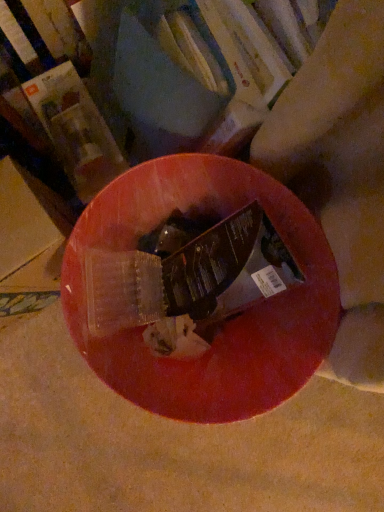
What do you see at coordinates (143, 79) in the screenshot? I see `hardcover book at center, placed as the second book when sorted from left to right` at bounding box center [143, 79].

Where is `hardcover book at center, which is counted as the first book, starting from the right`? This screenshot has width=384, height=512. hardcover book at center, which is counted as the first book, starting from the right is located at coordinates (143, 79).

The width and height of the screenshot is (384, 512). What do you see at coordinates (62, 91) in the screenshot? I see `matte plastic book at upper left, the first book positioned from the left` at bounding box center [62, 91].

Find the location of `matte plastic book at upper left, the first book positioned from the left`. matte plastic book at upper left, the first book positioned from the left is located at coordinates (62, 91).

This screenshot has width=384, height=512. I want to click on hardcover book at center, which is counted as the first book, starting from the right, so click(x=143, y=79).

Is hardcover book at center, placed as the second book when sorted from left to right, at the right side of matte plastic book at upper left, the first book positioned from the left?

Yes.

Based on the photo, which is in front, hardcover book at center, placed as the second book when sorted from left to right, or matte plastic book at upper left, which ranks as the 2th book in right-to-left order?

hardcover book at center, placed as the second book when sorted from left to right, is more forward.

Considering the positions of points (220, 35) and (36, 70), is point (220, 35) farther from camera compared to point (36, 70)?

No, (220, 35) is in front of (36, 70).

From the image's perspective, between hardcover book at center, placed as the second book when sorted from left to right, and matte plastic book at upper left, which ranks as the 2th book in right-to-left order, which one is located above?

From the image's view, hardcover book at center, placed as the second book when sorted from left to right, is above.

From a real-world perspective, between hardcover book at center, which is counted as the first book, starting from the right, and matte plastic book at upper left, which ranks as the 2th book in right-to-left order, who is vertically higher?

From a 3D spatial view, hardcover book at center, which is counted as the first book, starting from the right, is above.

Considering the relative sizes of hardcover book at center, placed as the second book when sorted from left to right, and matte plastic book at upper left, the first book positioned from the left, in the image provided, is hardcover book at center, placed as the second book when sorted from left to right, wider than matte plastic book at upper left, the first book positioned from the left,?

Incorrect, the width of hardcover book at center, placed as the second book when sorted from left to right, does not surpass that of matte plastic book at upper left, the first book positioned from the left.

In terms of height, does hardcover book at center, which is counted as the first book, starting from the right, look taller or shorter compared to matte plastic book at upper left, which ranks as the 2th book in right-to-left order?

Clearly, hardcover book at center, which is counted as the first book, starting from the right, is taller compared to matte plastic book at upper left, which ranks as the 2th book in right-to-left order.

Can you confirm if hardcover book at center, placed as the second book when sorted from left to right, is bigger than matte plastic book at upper left, the first book positioned from the left?

Yes.

Is matte plastic book at upper left, which ranks as the 2th book in right-to-left order, located within hardcover book at center, placed as the second book when sorted from left to right?

No.

Is hardcover book at center, which is counted as the first book, starting from the right, directly adjacent to matte plastic book at upper left, the first book positioned from the left?

Yes, hardcover book at center, which is counted as the first book, starting from the right, is in contact with matte plastic book at upper left, the first book positioned from the left.

Consider the image. Is hardcover book at center, placed as the second book when sorted from left to right, positioned with its back to matte plastic book at upper left, which ranks as the 2th book in right-to-left order?

No, matte plastic book at upper left, which ranks as the 2th book in right-to-left order, is not at the back of hardcover book at center, placed as the second book when sorted from left to right.

How many degrees apart are the facing directions of hardcover book at center, placed as the second book when sorted from left to right, and matte plastic book at upper left, the first book positioned from the left?

89.1 degrees.

At what (x,y) coordinates should I click in order to perform the action: click on book below the hardcover book at center, placed as the second book when sorted from left to right (from the image's perspective). Please return your answer as a coordinate pair (x, y). The height and width of the screenshot is (512, 384). Looking at the image, I should click on (62, 91).

From the picture: Can you confirm if matte plastic book at upper left, the first book positioned from the left, is positioned to the right of hardcover book at center, placed as the second book when sorted from left to right?

No.

Which object is closer to the camera, matte plastic book at upper left, the first book positioned from the left, or hardcover book at center, placed as the second book when sorted from left to right?

hardcover book at center, placed as the second book when sorted from left to right, is in front.

Considering the points (78, 133) and (129, 142), which point is in front, point (78, 133) or point (129, 142)?

Positioned in front is point (129, 142).

From the image's perspective, which one is positioned lower, matte plastic book at upper left, the first book positioned from the left, or hardcover book at center, which is counted as the first book, starting from the right?

matte plastic book at upper left, the first book positioned from the left, appears lower in the image.

From a real-world perspective, is matte plastic book at upper left, which ranks as the 2th book in right-to-left order, physically above hardcover book at center, which is counted as the first book, starting from the right?

No, from a real-world perspective, matte plastic book at upper left, which ranks as the 2th book in right-to-left order, is not above hardcover book at center, which is counted as the first book, starting from the right.

Which object is wider, matte plastic book at upper left, which ranks as the 2th book in right-to-left order, or hardcover book at center, placed as the second book when sorted from left to right?

With larger width is matte plastic book at upper left, which ranks as the 2th book in right-to-left order.

Does matte plastic book at upper left, which ranks as the 2th book in right-to-left order, have a greater height compared to hardcover book at center, which is counted as the first book, starting from the right?

Incorrect, the height of matte plastic book at upper left, which ranks as the 2th book in right-to-left order, is not larger of that of hardcover book at center, which is counted as the first book, starting from the right.

Between matte plastic book at upper left, the first book positioned from the left, and hardcover book at center, placed as the second book when sorted from left to right, which one has larger size?

Bigger between the two is hardcover book at center, placed as the second book when sorted from left to right.

Do you think matte plastic book at upper left, the first book positioned from the left, is within hardcover book at center, placed as the second book when sorted from left to right, or outside of it?

matte plastic book at upper left, the first book positioned from the left, is spatially situated outside hardcover book at center, placed as the second book when sorted from left to right.

Is matte plastic book at upper left, which ranks as the 2th book in right-to-left order, placed right next to hardcover book at center, which is counted as the first book, starting from the right?

Yes, matte plastic book at upper left, which ranks as the 2th book in right-to-left order, is beside hardcover book at center, which is counted as the first book, starting from the right.

Is matte plastic book at upper left, the first book positioned from the left, positioned with its back to hardcover book at center, which is counted as the first book, starting from the right?

No, hardcover book at center, which is counted as the first book, starting from the right, is not at the back of matte plastic book at upper left, the first book positioned from the left.

How many degrees apart are the facing directions of matte plastic book at upper left, the first book positioned from the left, and hardcover book at center, placed as the second book when sorted from left to right?

matte plastic book at upper left, the first book positioned from the left, and hardcover book at center, placed as the second book when sorted from left to right, are facing 89.1 degrees away from each other.

The height and width of the screenshot is (512, 384). I want to click on book behind the hardcover book at center, placed as the second book when sorted from left to right, so click(x=62, y=91).

Locate an element on the screen. book that appears in front of the matte plastic book at upper left, the first book positioned from the left is located at coordinates (143, 79).

The width and height of the screenshot is (384, 512). What are the coordinates of `book below the hardcover book at center, which is counted as the first book, starting from the right (from a real-world perspective)` in the screenshot? It's located at (62, 91).